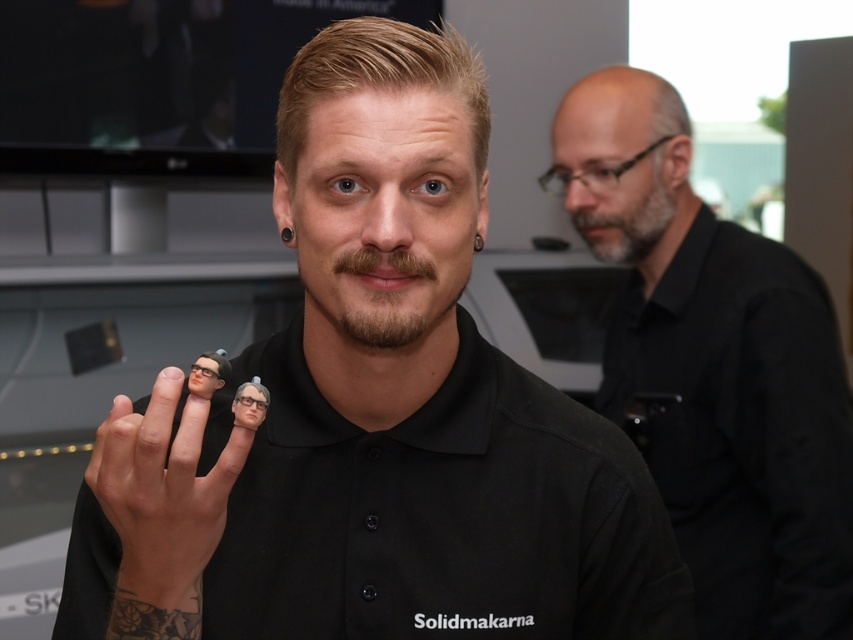
Question: Where is black matte finger puppet at center located in relation to clear plastic miniature at center in the image?

Choices:
 (A) below
 (B) above

Answer: (B)

Question: Which object is closer to the camera taking this photo?

Choices:
 (A) gray/bearded man at upper right
 (B) clear plastic miniature at center
 (C) brown matte beard at center
 (D) matte black finger at center

Answer: (D)

Question: Does brown matte beard at center have a lesser width compared to clear plastic miniature at center?

Choices:
 (A) no
 (B) yes

Answer: (A)

Question: Among these objects, which one is nearest to the camera?

Choices:
 (A) black matte finger puppet at center
 (B) clear plastic miniature at center
 (C) brown matte beard at center
 (D) matte black finger at center

Answer: (D)

Question: Observing the image, what is the correct spatial positioning of black matte shirt at upper right in reference to gray/bearded man at upper right?

Choices:
 (A) right
 (B) left

Answer: (A)

Question: Which object appears farthest from the camera in this image?

Choices:
 (A) gray/bearded man at upper right
 (B) black matte finger puppet at center

Answer: (A)